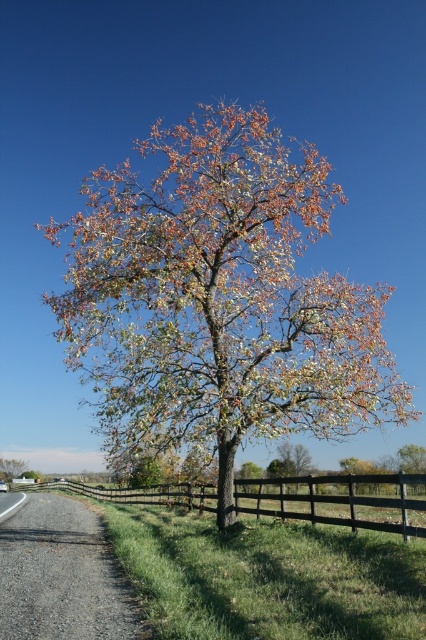
Does autumn leaves wood at center have a greater height compared to brown wooden fence at center?

Yes, autumn leaves wood at center is taller than brown wooden fence at center.

Locate an element on the screen. autumn leaves wood at center is located at coordinates (219, 298).

Image resolution: width=426 pixels, height=640 pixels. I want to click on autumn leaves wood at center, so click(x=219, y=298).

Is point (106, 557) less distant than point (9, 461)?

Yes.

Is gravel road at lower left closer to the viewer compared to green leafy tree at center?

Yes, it is in front of green leafy tree at center.

Between point (104, 586) and point (8, 481), which one is positioned behind?

Positioned behind is point (8, 481).

Locate an element on the screen. The width and height of the screenshot is (426, 640). gravel road at lower left is located at coordinates (60, 576).

Between gravel road at lower left and brown wooden fence at center, which one appears on the left side from the viewer's perspective?

Positioned to the left is gravel road at lower left.

The width and height of the screenshot is (426, 640). Identify the location of gravel road at lower left. (60, 576).

What are the coordinates of `gravel road at lower left` in the screenshot? It's located at (60, 576).